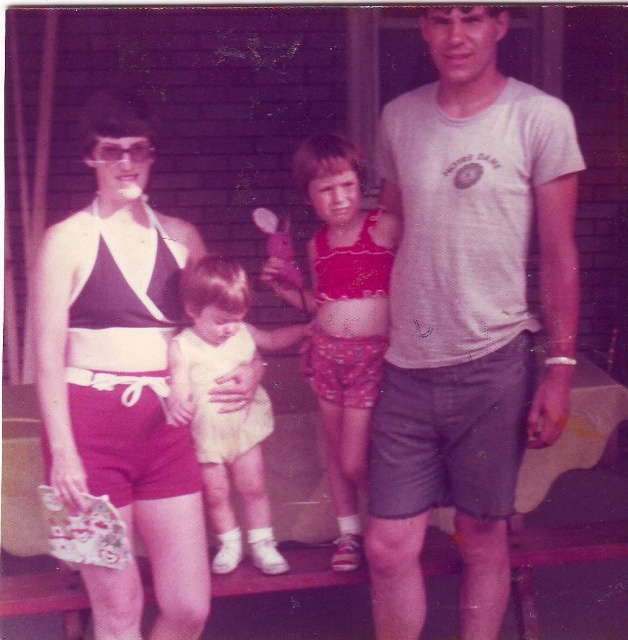
Which is behind, point (428, 196) or point (95, 324)?

The point (95, 324) is behind.

Is white cotton t-shirt at center behind matte black swimsuit at left?

No, it is in front of matte black swimsuit at left.

I want to click on white cotton t-shirt at center, so click(467, 312).

You are a GUI agent. You are given a task and a screenshot of the screen. Output one action in this format:
    pyautogui.click(x=<x>, y=<y>)
    Task: Click on the red cotton swimsuit at center
    This screenshot has width=628, height=640.
    Given the screenshot: What is the action you would take?
    pyautogui.click(x=340, y=317)

You are a GUI agent. You are given a task and a screenshot of the screen. Output one action in this format:
    pyautogui.click(x=<x>, y=<y>)
    Task: Click on the red cotton swimsuit at center
    This screenshot has width=628, height=640.
    Given the screenshot: What is the action you would take?
    pyautogui.click(x=340, y=317)

Between point (441, 417) and point (325, 260), which one is positioned in front?

Point (441, 417)

Can you confirm if white cotton t-shirt at center is positioned below red cotton swimsuit at center?

No, white cotton t-shirt at center is not below red cotton swimsuit at center.

Is point (553, 412) more distant than point (381, 237)?

No, it is not.

Locate an element on the screen. white cotton t-shirt at center is located at coordinates (467, 312).